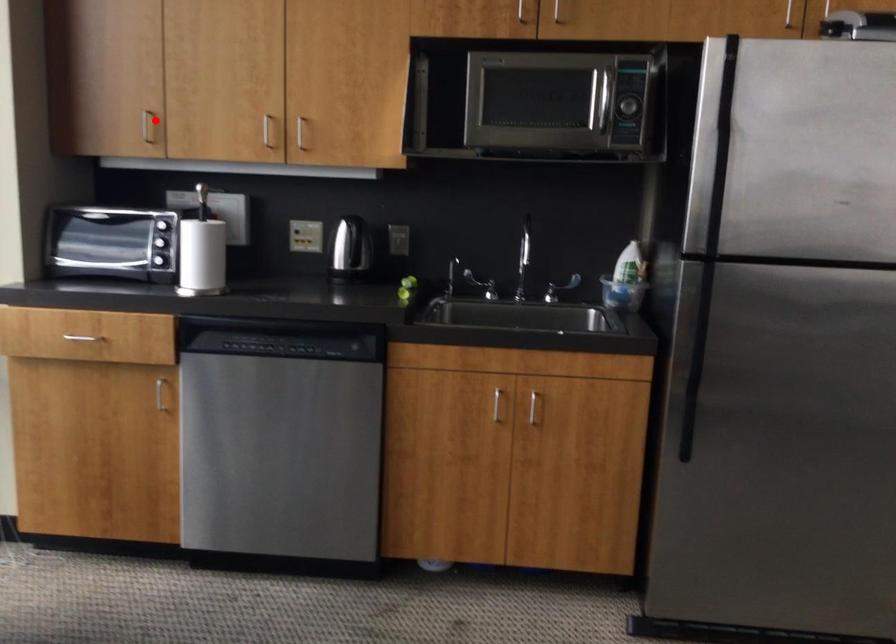
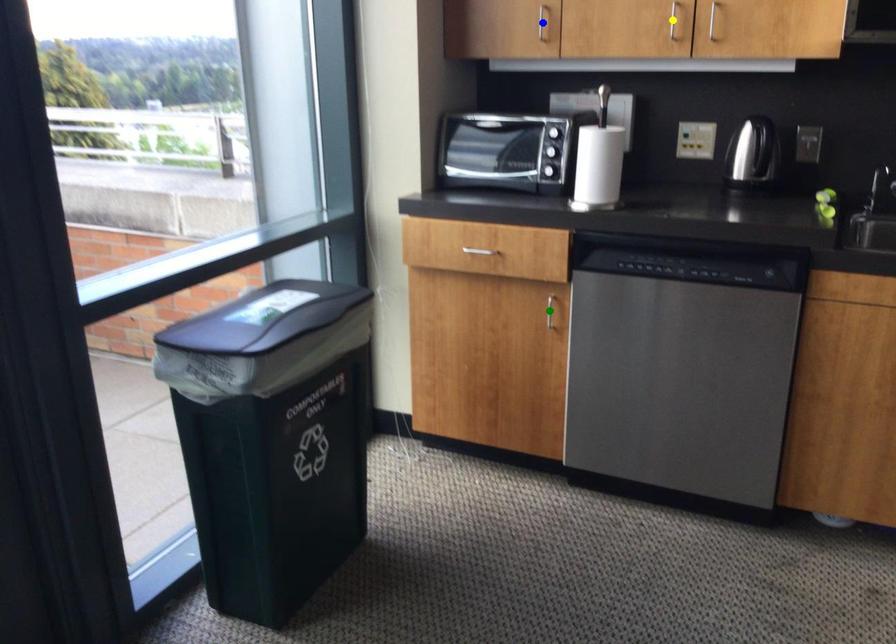
Question: I am providing you with two images of the same scene from different viewpoints. A red point is marked on the first image. You are given multiple points on the second image. Which spot in image 2 lines up with the point in image 1?

Choices:
 (A) blue point
 (B) green point
 (C) yellow point

Answer: (A)